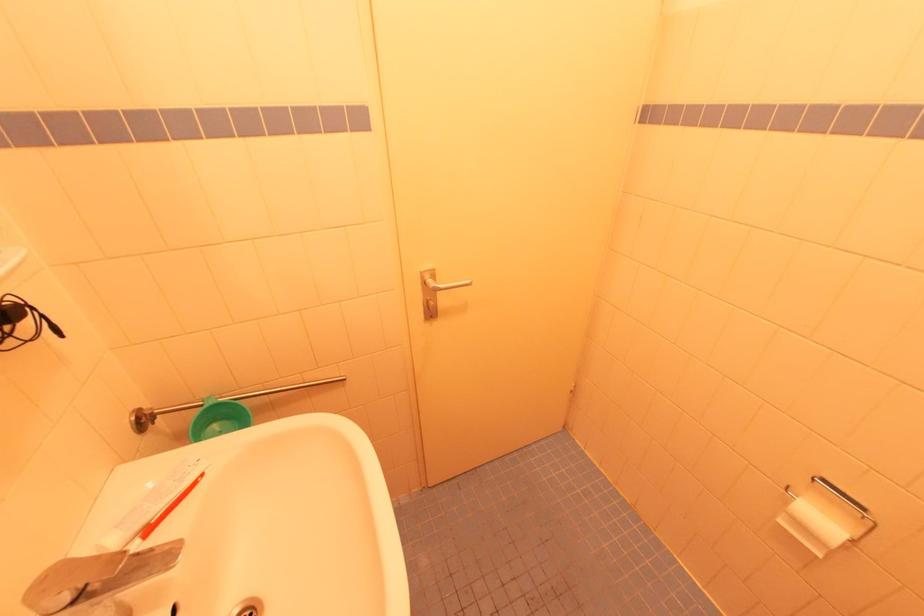
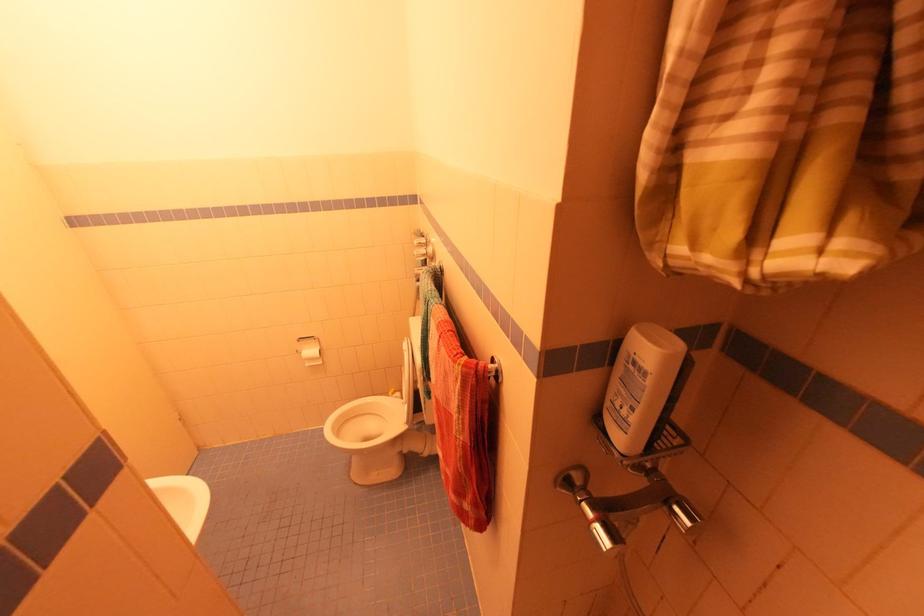
In the second image, find the point that corresponds to (x=867, y=509) in the first image.

(314, 338)